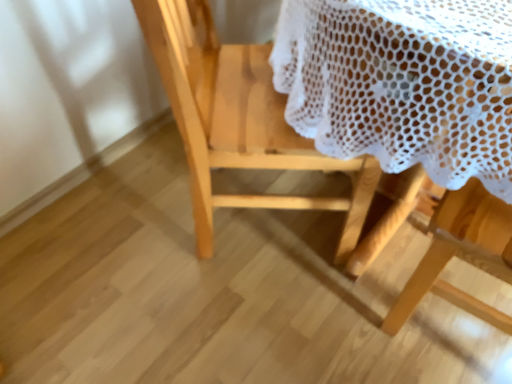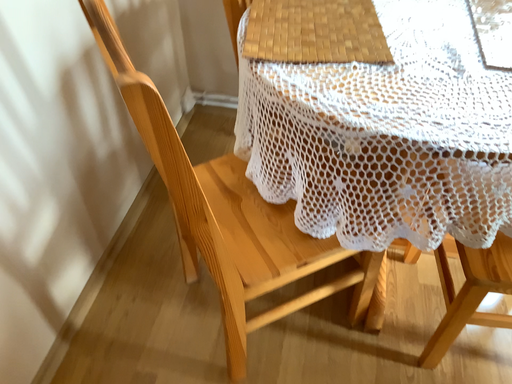
Question: Which way did the camera rotate in the video?

Choices:
 (A) rotated left
 (B) rotated right

Answer: (B)